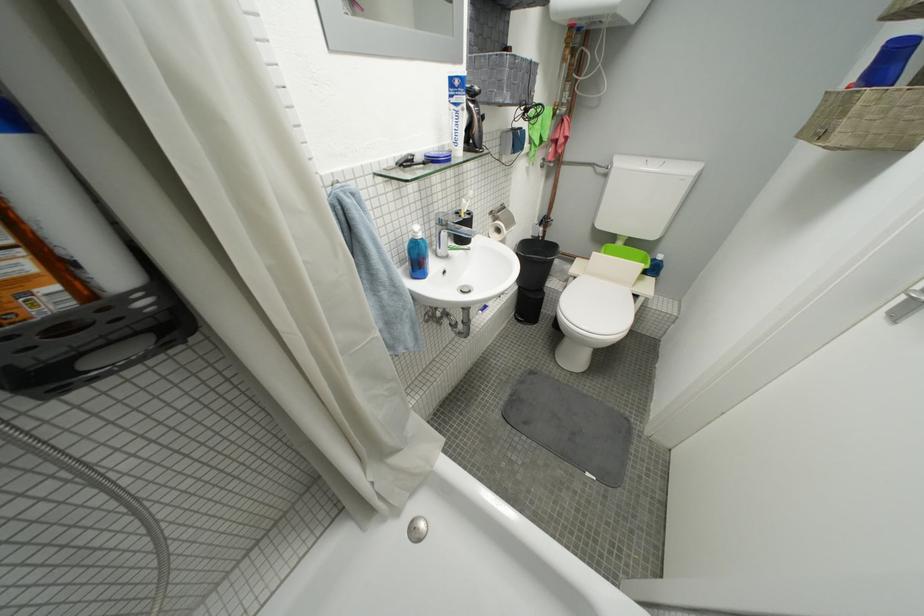
Find the location of a particular element. Image resolution: width=924 pixels, height=616 pixels. blue soap dispenser is located at coordinates (418, 254).